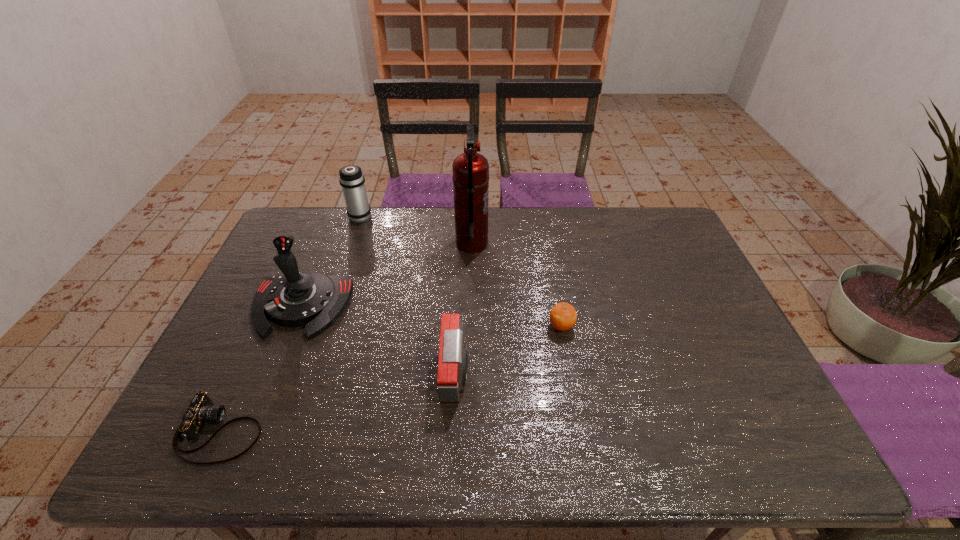
The width and height of the screenshot is (960, 540). I want to click on free location located 0.340m on the nozzle side of the tallest object, so click(x=589, y=244).

Where is `blank area located 0.250m on the handle side of the joystick`? The height and width of the screenshot is (540, 960). blank area located 0.250m on the handle side of the joystick is located at coordinates (252, 427).

At what (x,y) coordinates should I click in order to perform the action: click on vacant space located 0.400m on the front-facing side of the right camera. Please return your answer as a coordinate pair (x, y). Looking at the image, I should click on (629, 375).

In order to click on vacant space located 0.400m on the left of the orange in this screenshot , I will do `click(403, 327)`.

Locate an element on the screen. The height and width of the screenshot is (540, 960). free spot located 0.230m on the front-facing side of the shorter camera is located at coordinates (364, 431).

At what (x,y) coordinates should I click in order to perform the action: click on fire extinguisher that is at the far edge. Please return your answer as a coordinate pair (x, y). The height and width of the screenshot is (540, 960). Looking at the image, I should click on (470, 177).

At what (x,y) coordinates should I click in order to perform the action: click on thermos bottle that is at the far edge. Please return your answer as a coordinate pair (x, y). Image resolution: width=960 pixels, height=540 pixels. Looking at the image, I should click on (352, 180).

Image resolution: width=960 pixels, height=540 pixels. In order to click on object at the near edge in this screenshot , I will do (x=201, y=410).

At what (x,y) coordinates should I click in order to perform the action: click on joystick located in the left edge section of the desktop. Please return your answer as a coordinate pair (x, y). Looking at the image, I should click on (294, 299).

Where is `camera located at the left edge`? camera located at the left edge is located at coordinates (201, 410).